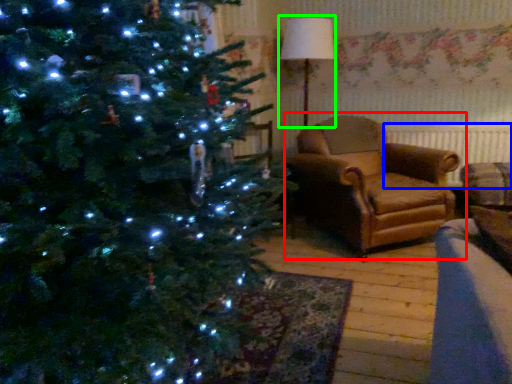
Question: Considering the real-world distances, which object is farthest from studio couch (highlighted by a red box)? radiator (highlighted by a blue box) or lamp (highlighted by a green box)?

Choices:
 (A) radiator
 (B) lamp

Answer: (B)